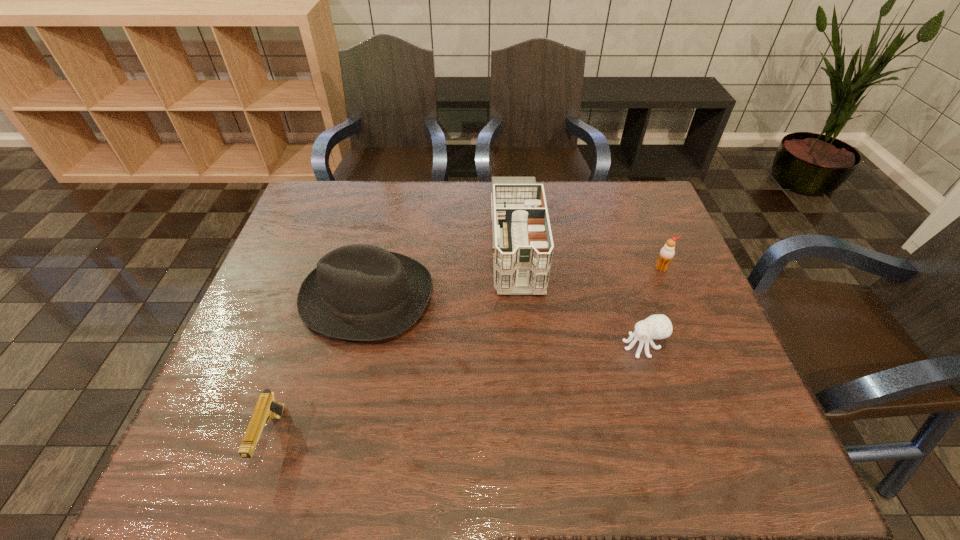
Locate an element on the screen. This screenshot has height=540, width=960. vacant point located on the front-facing side of the octopus is located at coordinates (589, 346).

At what (x,y) coordinates should I click in order to perform the action: click on free space located 0.130m on the front-facing side of the octopus. Please return your answer as a coordinate pair (x, y). This screenshot has height=540, width=960. Looking at the image, I should click on (568, 346).

Where is `object positioned at the far edge`? The image size is (960, 540). object positioned at the far edge is located at coordinates (523, 246).

Locate an element on the screen. The height and width of the screenshot is (540, 960). object positioned at the near edge is located at coordinates (267, 408).

Find the location of a particular element. This screenshot has width=960, height=540. fedora at the left edge is located at coordinates point(359,292).

Where is `pistol located at the left edge`? pistol located at the left edge is located at coordinates (267, 408).

I want to click on icecream present at the right edge, so click(x=667, y=252).

Identify the location of octopus that is at the right edge. This screenshot has height=540, width=960. (659, 326).

In order to click on object that is at the near left corner in this screenshot , I will do `click(267, 408)`.

Image resolution: width=960 pixels, height=540 pixels. In order to click on vacant area at the far edge of the desktop in this screenshot , I will do `click(573, 216)`.